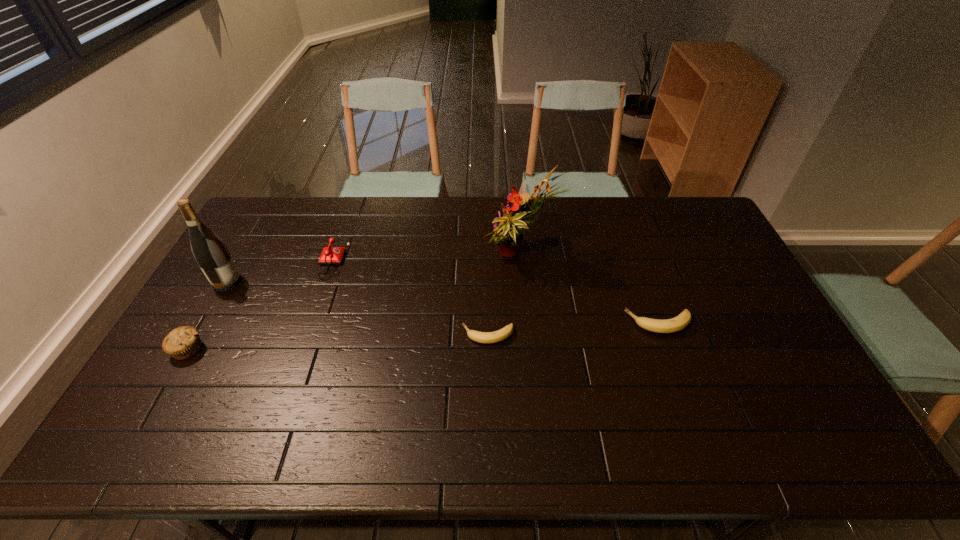
Where is `object that can be found as the third closest to the bouquet`? object that can be found as the third closest to the bouquet is located at coordinates (330, 255).